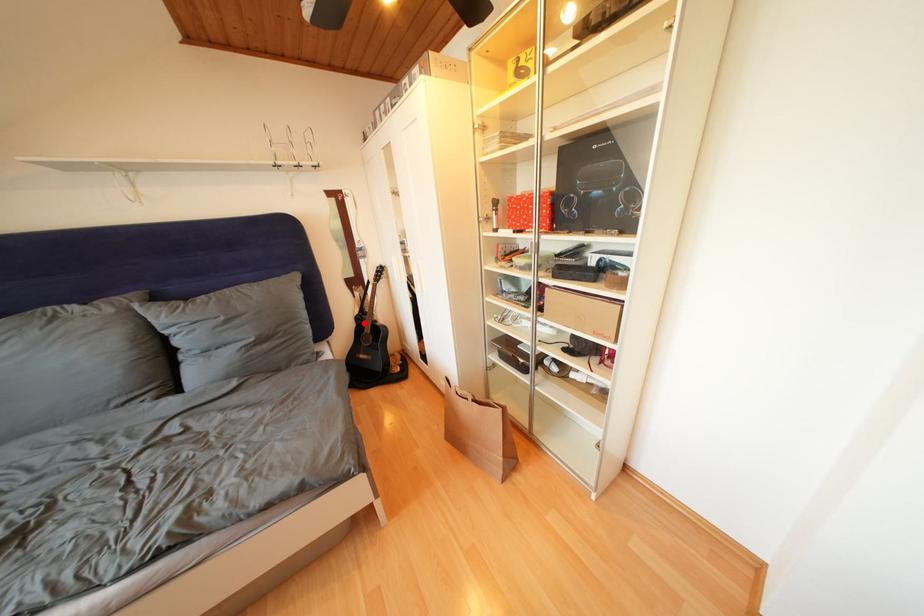
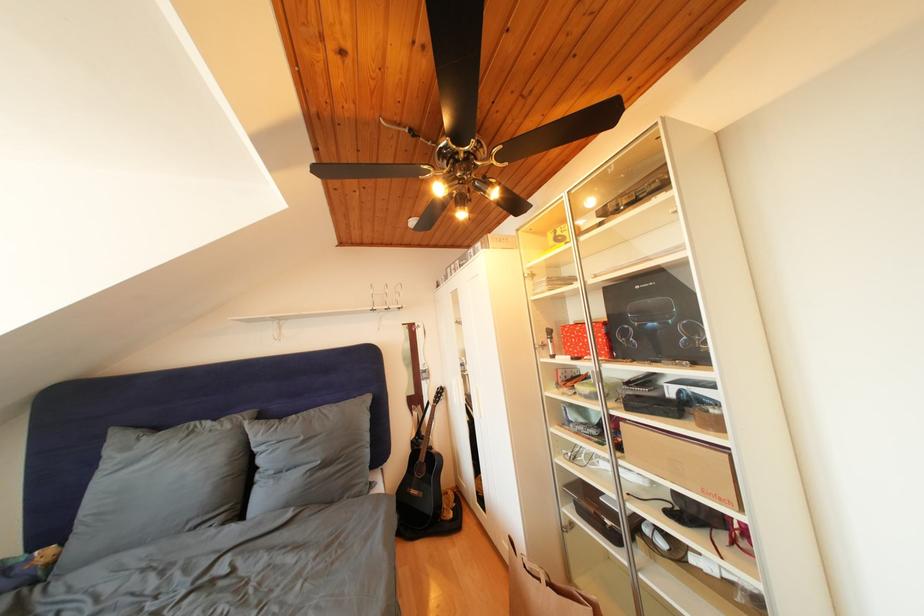
Question: I am providing you with two images of the same scene from different viewpoints. In image1, a red point is highlighted. Considering the same 3D point in image2, which of the following is correct?

Choices:
 (A) It is closer
 (B) It is farther

Answer: (B)